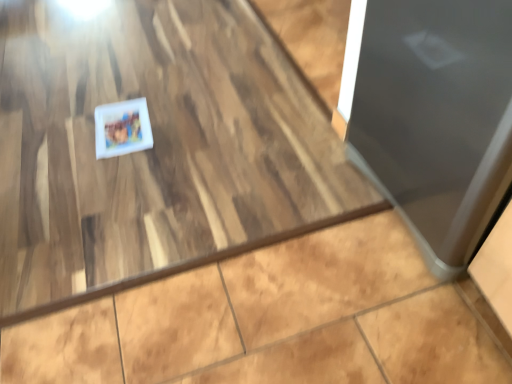
Question: From a real-world perspective, relative to glossy metallic door at right, is white matte postcard at center vertically above or below?

Choices:
 (A) above
 (B) below

Answer: (B)

Question: In terms of width, does white matte postcard at center look wider or thinner when compared to glossy metallic door at right?

Choices:
 (A) wide
 (B) thin

Answer: (B)

Question: From their relative heights in the image, would you say white matte postcard at center is taller or shorter than glossy metallic door at right?

Choices:
 (A) tall
 (B) short

Answer: (B)

Question: Is glossy metallic door at right spatially inside white matte postcard at center, or outside of it?

Choices:
 (A) inside
 (B) outside

Answer: (B)

Question: In terms of size, does glossy metallic door at right appear bigger or smaller than white matte postcard at center?

Choices:
 (A) big
 (B) small

Answer: (A)

Question: Is point (460, 48) positioned closer to the camera than point (103, 107)?

Choices:
 (A) farther
 (B) closer

Answer: (B)

Question: Considering the positions of glossy metallic door at right and white matte postcard at center in the image, is glossy metallic door at right wider or thinner than white matte postcard at center?

Choices:
 (A) wide
 (B) thin

Answer: (A)